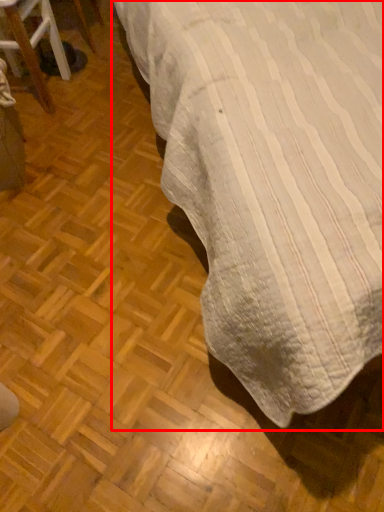
Question: Where is table (annotated by the red box) located in relation to furniture in the image?

Choices:
 (A) left
 (B) right

Answer: (B)